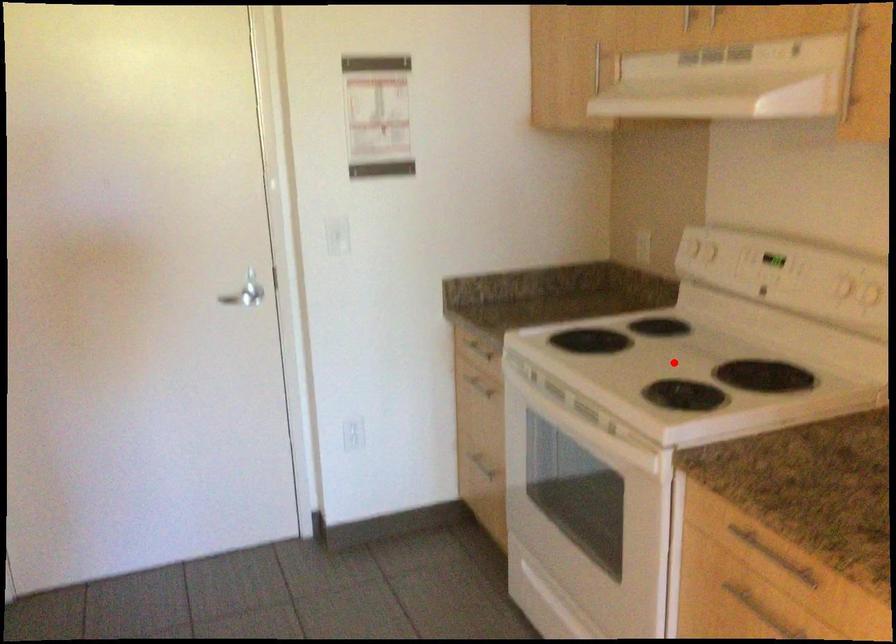
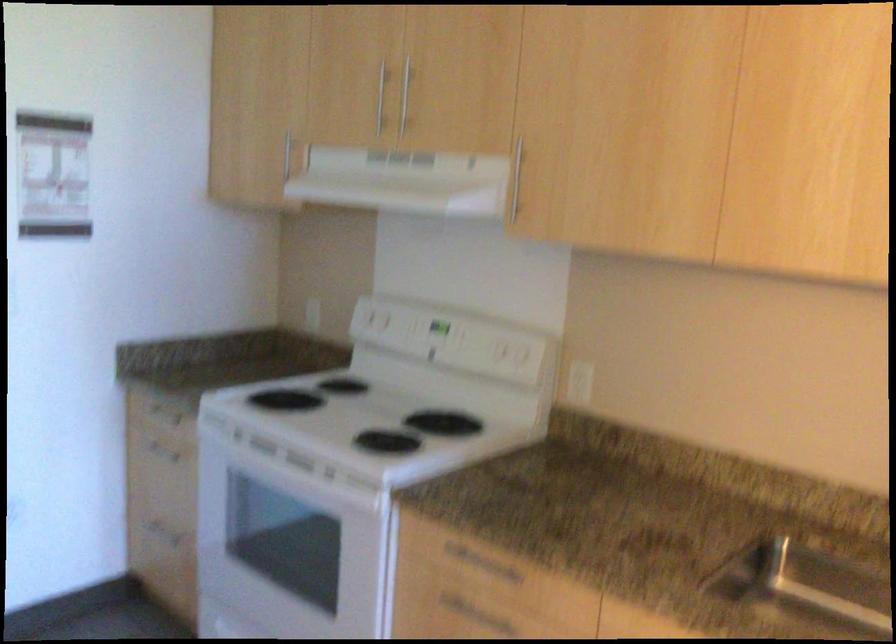
Question: I am providing you with two images of the same scene from different viewpoints. A red point is marked on the first image. Can you still see the location of the red point in image 2?

Choices:
 (A) Yes
 (B) No

Answer: (A)